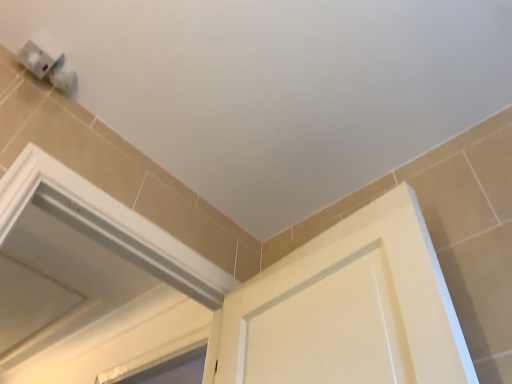
Image resolution: width=512 pixels, height=384 pixels. I want to click on white glossy door at lower left, so click(x=91, y=261).

Describe the element at coordinates (91, 261) in the screenshot. The width and height of the screenshot is (512, 384). I see `white glossy door at lower left` at that location.

Locate an element on the screen. white glossy door at lower left is located at coordinates (91, 261).